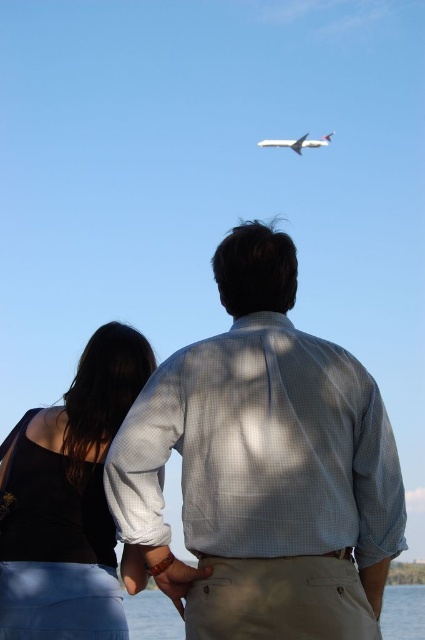
Between point (353, 406) and point (289, 144), which one is positioned behind?

Positioned behind is point (289, 144).

Is white checkered shirt at center above white matte airplane at upper center?

No, white checkered shirt at center is not above white matte airplane at upper center.

Is point (379, 397) closer to camera compared to point (289, 144)?

That is True.

At what (x,y) coordinates should I click in order to perform the action: click on white checkered shirt at center. Please return your answer as a coordinate pair (x, y). The image size is (425, 640). Looking at the image, I should click on (266, 465).

I want to click on black matte tank top at lower left, so click(70, 500).

What do you see at coordinates (70, 500) in the screenshot? The height and width of the screenshot is (640, 425). I see `black matte tank top at lower left` at bounding box center [70, 500].

You are a GUI agent. You are given a task and a screenshot of the screen. Output one action in this format:
    pyautogui.click(x=<x>, y=<y>)
    Task: Click on the black matte tank top at lower left
    
    Given the screenshot: What is the action you would take?
    pyautogui.click(x=70, y=500)

Is matte khaki pants at lower center shorter than white matte airplane at upper center?

Indeed, matte khaki pants at lower center has a lesser height compared to white matte airplane at upper center.

Between point (169, 568) and point (289, 141), which one is positioned in front?

Point (169, 568) is in front.

Locate an element on the screen. The image size is (425, 640). matte khaki pants at lower center is located at coordinates (173, 573).